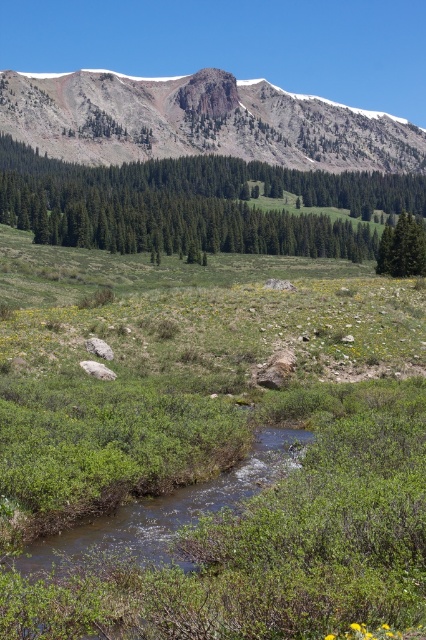
Question: Which point is closer to the camera?

Choices:
 (A) green matte tree at right
 (B) rusty rock mountain at upper center

Answer: (A)

Question: Can you confirm if green textured tree at center is smaller than green matte tree at right?

Choices:
 (A) no
 (B) yes

Answer: (A)

Question: From the image, what is the correct spatial relationship of green textured tree at center in relation to green matte tree at right?

Choices:
 (A) below
 (B) above

Answer: (B)

Question: Can you confirm if green textured tree at center is positioned below green matte tree at right?

Choices:
 (A) no
 (B) yes

Answer: (A)

Question: Estimate the real-world distances between objects in this image. Which object is farther from the rusty rock mountain at upper center?

Choices:
 (A) green matte tree at right
 (B) green textured tree at center

Answer: (A)

Question: Considering the real-world distances, which object is closest to the rusty rock mountain at upper center?

Choices:
 (A) green matte tree at right
 (B) green textured tree at center

Answer: (B)